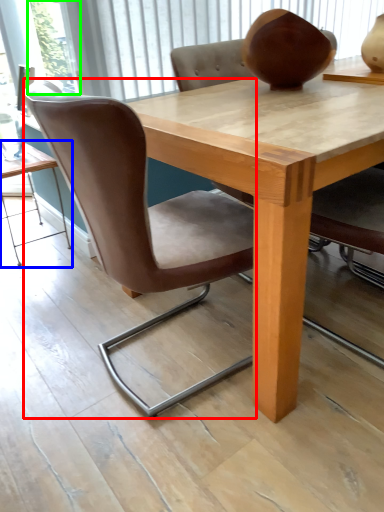
Question: Considering the real-world distances, which object is farthest from chair (highlighted by a red box)? table (highlighted by a blue box) or glass door (highlighted by a green box)?

Choices:
 (A) table
 (B) glass door

Answer: (B)